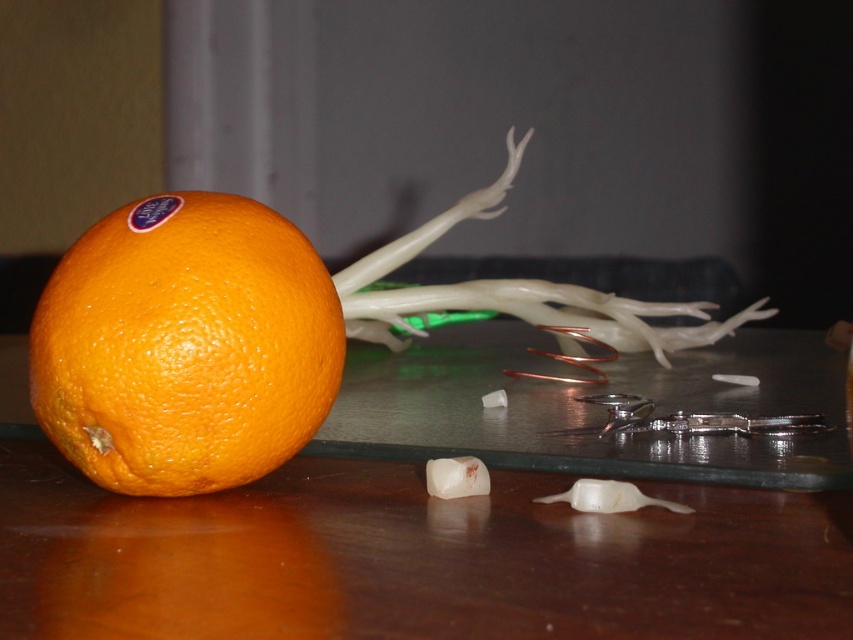
Can you confirm if orangesmoothfruit at left is shorter than translucent white onion at center?

Yes, orangesmoothfruit at left is shorter than translucent white onion at center.

Who is more distant from viewer, (241, 460) or (482, 204)?

The point (482, 204) is behind.

Measure the distance between point (165, 472) and camera.

They are 35.76 centimeters apart.

Locate an element on the screen. Image resolution: width=853 pixels, height=640 pixels. orangesmoothfruit at left is located at coordinates (184, 346).

Image resolution: width=853 pixels, height=640 pixels. In order to click on wooden table at lower left in this screenshot , I will do `click(460, 515)`.

Between point (335, 433) and point (96, 412), which one is positioned in front?

Point (96, 412)

Identify the location of wooden table at lower left. (460, 515).

Does wooden table at lower left have a larger size compared to translucent white onion at center?

Correct, wooden table at lower left is larger in size than translucent white onion at center.

Does wooden table at lower left appear on the right side of translucent white onion at center?

No, wooden table at lower left is not to the right of translucent white onion at center.

Who is more forward, (248, 604) or (762, 310)?

Point (248, 604)

Where is `wooden table at lower left`? The height and width of the screenshot is (640, 853). wooden table at lower left is located at coordinates (460, 515).